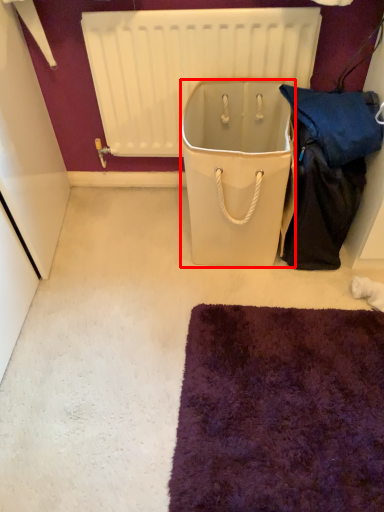
Question: From the image's perspective, where is cooler (annotated by the red box) located relative to radiator?

Choices:
 (A) below
 (B) above

Answer: (A)